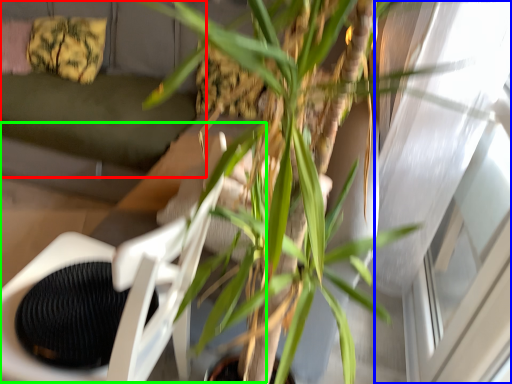
Question: Which is nearer to the couch (highlighted by a red box)? window (highlighted by a blue box) or swivel chair (highlighted by a green box).

Choices:
 (A) window
 (B) swivel chair

Answer: (B)